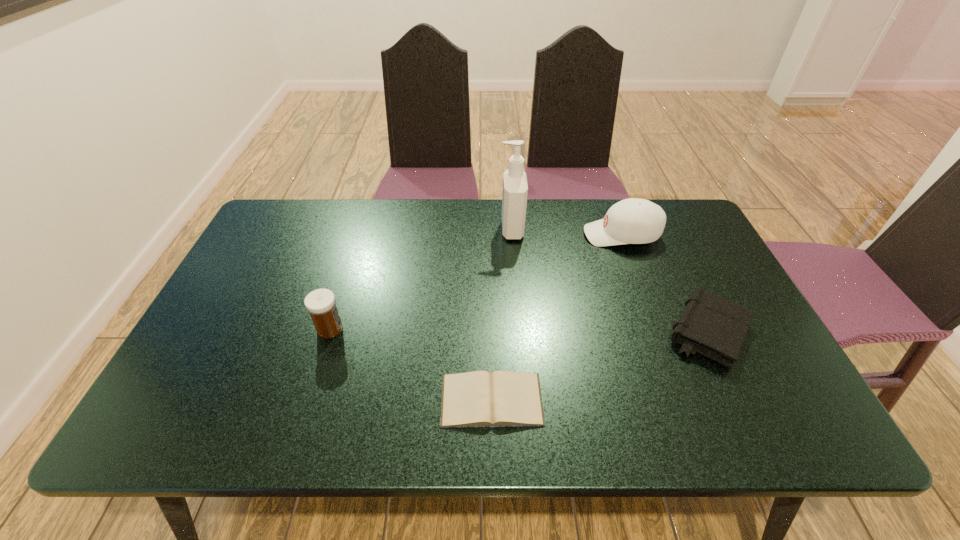
The width and height of the screenshot is (960, 540). What are the coordinates of `free spot between the nearest object and the second shortest object` in the screenshot? It's located at (600, 366).

Locate an element on the screen. empty space that is in between the cleansing agent and the taller Bible is located at coordinates (610, 281).

In order to click on vacant area that lies between the leftmost object and the farther Bible in this screenshot , I will do coord(519,330).

Find the location of a particular element. The width and height of the screenshot is (960, 540). free space that is in between the baseball cap and the nearer Bible is located at coordinates pyautogui.click(x=557, y=317).

Image resolution: width=960 pixels, height=540 pixels. I want to click on vacant region between the baseball cap and the medicine, so click(x=476, y=282).

Locate an element on the screen. The image size is (960, 540). free spot between the leftmost object and the nearest object is located at coordinates (411, 364).

Locate an element on the screen. vacant space that's between the fourth tallest object and the baseball cap is located at coordinates (665, 283).

The height and width of the screenshot is (540, 960). In order to click on object that is the third closest to the baseball cap in this screenshot , I will do `click(502, 398)`.

Locate an element on the screen. Image resolution: width=960 pixels, height=540 pixels. object that is the closest to the second shortest object is located at coordinates (631, 221).

Where is `free space that satisfies the following two spatial constraints: 1. on the front label of the tallest object; 2. on the back side of the right Bible`? This screenshot has width=960, height=540. free space that satisfies the following two spatial constraints: 1. on the front label of the tallest object; 2. on the back side of the right Bible is located at coordinates (519, 332).